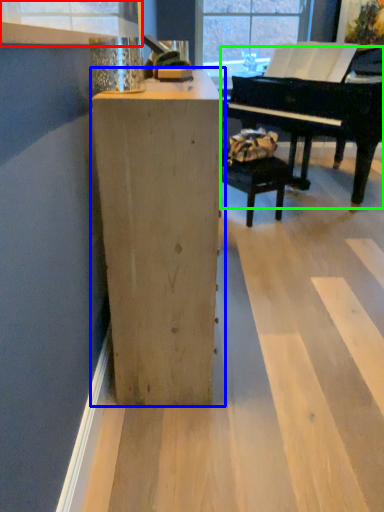
Question: Based on their relative distances, which object is nearer to window frame (highlighted by a red box)? Choose from furniture (highlighted by a blue box) and piano (highlighted by a green box).

Choices:
 (A) furniture
 (B) piano

Answer: (A)